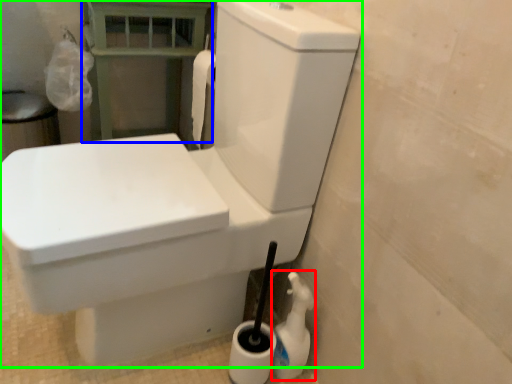
Question: Which is farther away from cleaning product (highlighted by a red box)? balustrade (highlighted by a blue box) or toilet (highlighted by a green box)?

Choices:
 (A) balustrade
 (B) toilet

Answer: (A)